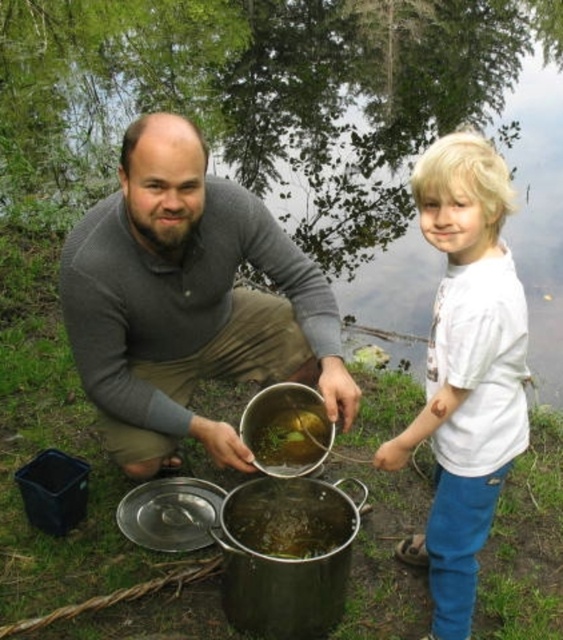
Question: Considering the real-world distances, which object is farthest from the green matte pot at center?

Choices:
 (A) white cotton shirt at right
 (B) matte gray sweater at center

Answer: (A)

Question: Does matte gray sweater at center have a greater width compared to green matte pot at center?

Choices:
 (A) no
 (B) yes

Answer: (B)

Question: Which point appears farthest from the camera in this image?

Choices:
 (A) (212, 240)
 (B) (439, 490)
 (C) (283, 444)

Answer: (C)

Question: Which point is farther to the camera?

Choices:
 (A) green matte pot at center
 (B) white cotton shirt at right
 (C) matte gray sweater at center

Answer: (A)

Question: Is matte gray sweater at center smaller than green matte pot at center?

Choices:
 (A) yes
 (B) no

Answer: (B)

Question: From the image, what is the correct spatial relationship of matte gray sweater at center in relation to white cotton shirt at right?

Choices:
 (A) below
 (B) above

Answer: (B)